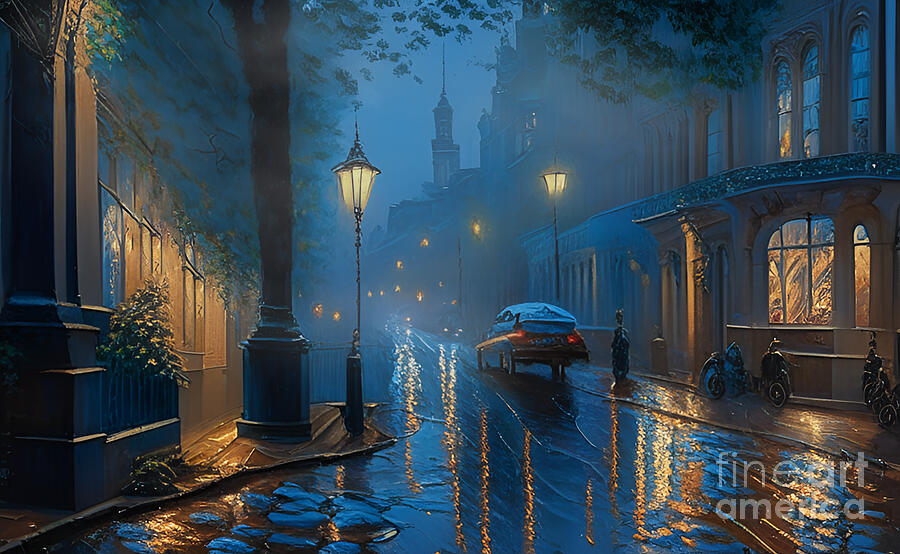
This screenshot has width=900, height=554. I want to click on windows, so click(x=860, y=269), click(x=823, y=269), click(x=796, y=268), click(x=774, y=275), click(x=787, y=135), click(x=813, y=102), click(x=862, y=91), click(x=714, y=155), click(x=189, y=319), click(x=115, y=254).